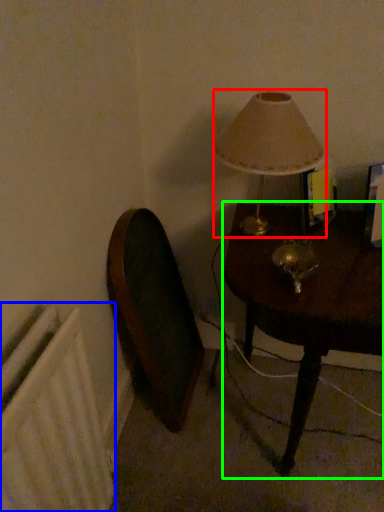
Question: Which object is the closest to the lamp (highlighted by a red box)? Choose among these: radiator (highlighted by a blue box) or table (highlighted by a green box).

Choices:
 (A) radiator
 (B) table

Answer: (B)